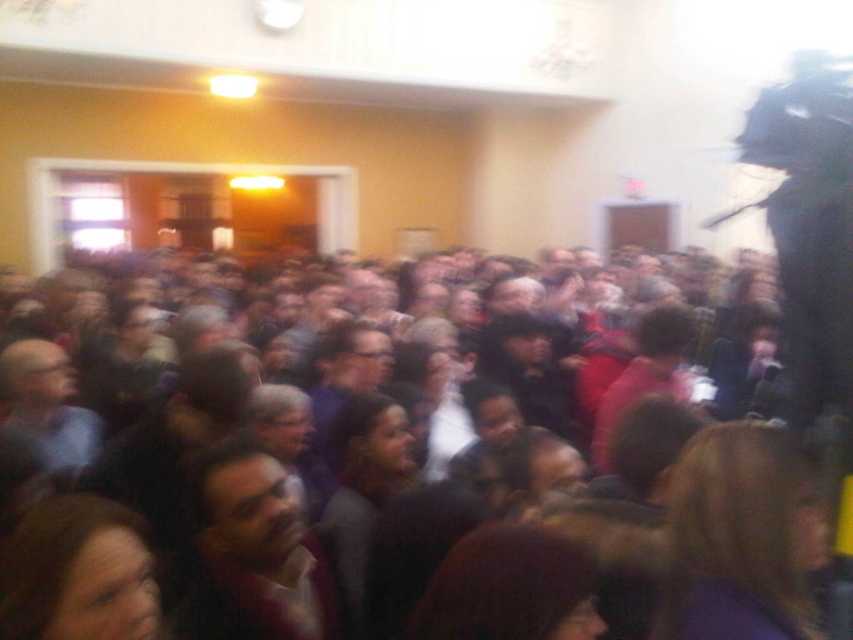
You are organizing a photo shoot and need to ensure that the dark brown hair at center and the smooth brown shirt at center are both visible in the frame. Given their sizes, which object should you focus on to ensure both are captured clearly?

The dark brown hair at center is bigger than the smooth brown shirt at center, so focusing on the dark brown hair at center will help ensure both are visible in the frame.

You are standing at the entrance of the hall and want to locate the person with dark brown hair at center. According to the coordinates provided, in which direction should you look relative to your position?

You should look towards the center of the hall since the dark brown hair at center is located at point (210, 349), which is centrally positioned in the image.